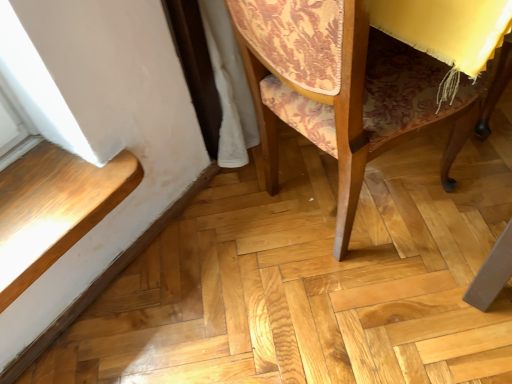
What is the approximate height of patterned fabric chair at center?

patterned fabric chair at center is 27.98 inches tall.

The image size is (512, 384). Describe the element at coordinates (344, 89) in the screenshot. I see `patterned fabric chair at center` at that location.

This screenshot has width=512, height=384. What are the coordinates of `patterned fabric chair at center` in the screenshot? It's located at (344, 89).

The height and width of the screenshot is (384, 512). What do you see at coordinates (53, 209) in the screenshot?
I see `wooden floor at lower left` at bounding box center [53, 209].

I want to click on wooden floor at lower left, so click(53, 209).

Where is `patterned fabric chair at center`? This screenshot has width=512, height=384. patterned fabric chair at center is located at coordinates (344, 89).

Based on their positions, is patterned fabric chair at center located to the left or right of wooden floor at lower left?

Clearly, patterned fabric chair at center is on the right of wooden floor at lower left in the image.

Is the position of patterned fabric chair at center more distant than that of wooden floor at lower left?

No, patterned fabric chair at center is closer to the camera.

Between point (459, 102) and point (6, 220), which one is positioned in front?

The point (459, 102) is more forward.

From the image's perspective, which object appears higher, patterned fabric chair at center or wooden floor at lower left?

patterned fabric chair at center is shown above in the image.

From a real-world perspective, is patterned fabric chair at center positioned under wooden floor at lower left based on gravity?

Incorrect, from a real-world perspective, patterned fabric chair at center is higher than wooden floor at lower left.

Is patterned fabric chair at center thinner than wooden floor at lower left?

In fact, patterned fabric chair at center might be wider than wooden floor at lower left.

Can you confirm if patterned fabric chair at center is shorter than wooden floor at lower left?

Incorrect, the height of patterned fabric chair at center does not fall short of that of wooden floor at lower left.

Is patterned fabric chair at center bigger than wooden floor at lower left?

Yes, patterned fabric chair at center is bigger than wooden floor at lower left.

Is wooden floor at lower left a part of patterned fabric chair at center?

Definitely not — wooden floor at lower left is not inside patterned fabric chair at center.

Is patterned fabric chair at center not close to wooden floor at lower left?

patterned fabric chair at center is near wooden floor at lower left, not far away.

Is patterned fabric chair at center oriented away from wooden floor at lower left?

Correct, patterned fabric chair at center is looking away from wooden floor at lower left.

How different are the orientations of patterned fabric chair at center and wooden floor at lower left in degrees?

72.7 degrees separate the facing orientations of patterned fabric chair at center and wooden floor at lower left.

Locate an element on the screen. Image resolution: width=512 pixels, height=384 pixels. chair located in front of the wooden floor at lower left is located at coordinates (344, 89).

Between wooden floor at lower left and patterned fabric chair at center, which one appears on the left side from the viewer's perspective?

From the viewer's perspective, wooden floor at lower left appears more on the left side.

Is the position of wooden floor at lower left more distant than that of patterned fabric chair at center?

Yes, wooden floor at lower left is further from the viewer.

Does point (110, 162) come behind point (362, 78)?

Yes, it is behind point (362, 78).

From the image's perspective, which one is positioned higher, wooden floor at lower left or patterned fabric chair at center?

patterned fabric chair at center is shown above in the image.

From a real-world perspective, relative to patterned fabric chair at center, is wooden floor at lower left vertically above or below?

wooden floor at lower left is situated lower than patterned fabric chair at center in the real world.

Is wooden floor at lower left thinner than patterned fabric chair at center?

Yes.

Which of these two, wooden floor at lower left or patterned fabric chair at center, stands taller?

With more height is patterned fabric chair at center.

Considering the sizes of objects wooden floor at lower left and patterned fabric chair at center in the image provided, who is smaller, wooden floor at lower left or patterned fabric chair at center?

wooden floor at lower left.

Is wooden floor at lower left inside the boundaries of patterned fabric chair at center, or outside?

wooden floor at lower left is not inside patterned fabric chair at center, it's outside.

Is wooden floor at lower left with patterned fabric chair at center?

No, wooden floor at lower left is not beside patterned fabric chair at center.

Is wooden floor at lower left facing towards patterned fabric chair at center?

No, wooden floor at lower left is not oriented towards patterned fabric chair at center.

How different are the orientations of wooden floor at lower left and patterned fabric chair at center in degrees?

They differ by 72.7 degrees in their facing directions.

Based on the photo, measure the distance between wooden floor at lower left and patterned fabric chair at center.

The distance of wooden floor at lower left from patterned fabric chair at center is 50.73 centimeters.

What are the coordinates of `chair in front of the wooden floor at lower left` in the screenshot? It's located at (344, 89).

Identify the location of stairwell on the left of patterned fabric chair at center. The height and width of the screenshot is (384, 512). (53, 209).

Image resolution: width=512 pixels, height=384 pixels. Find the location of `chair located on the right of wooden floor at lower left`. chair located on the right of wooden floor at lower left is located at coordinates (344, 89).